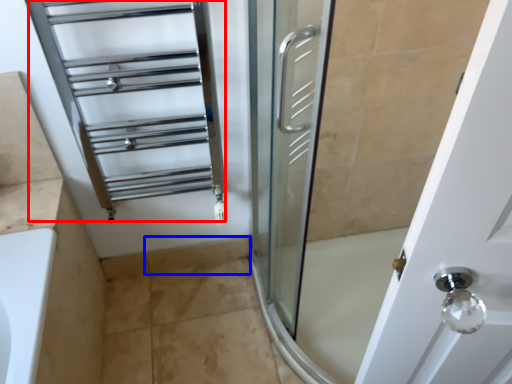
Question: Which object appears farthest to the camera in this image, cage (highlighted by a red box) or tile (highlighted by a blue box)?

Choices:
 (A) cage
 (B) tile

Answer: (B)